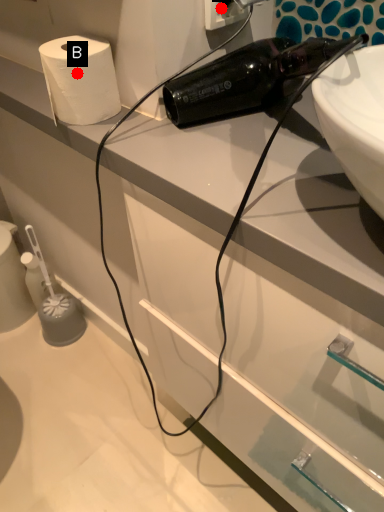
Question: Two points are circled on the image, labeled by A and B beside each circle. Which point appears closest to the camera in this image?

Choices:
 (A) A is closer
 (B) B is closer

Answer: (B)